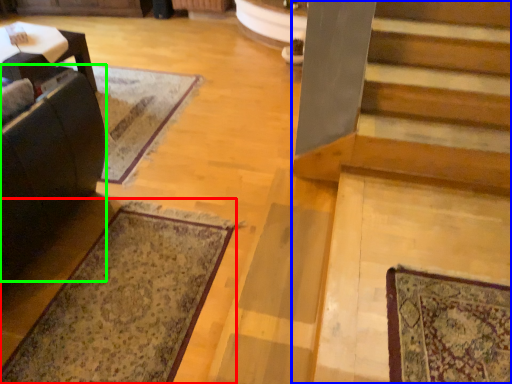
Question: Which object is the farthest from mat (highlighted by a red box)? Choose among these: stairs (highlighted by a blue box) or rocking chair (highlighted by a green box).

Choices:
 (A) stairs
 (B) rocking chair

Answer: (A)